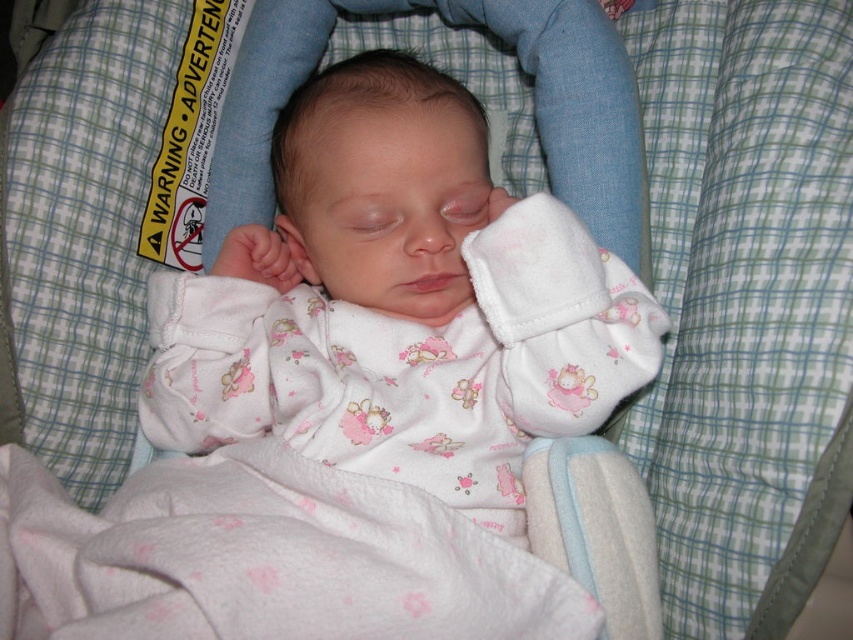
Does white soft fabric baby at center appear on the right side of white fleece blanket at center?

Correct, you'll find white soft fabric baby at center to the right of white fleece blanket at center.

Is white soft fabric baby at center to the left of white fleece blanket at center from the viewer's perspective?

No, white soft fabric baby at center is not to the left of white fleece blanket at center.

Does point (451, 440) come in front of point (395, 620)?

No.

Where is `white soft fabric baby at center`? This screenshot has height=640, width=853. white soft fabric baby at center is located at coordinates (398, 304).